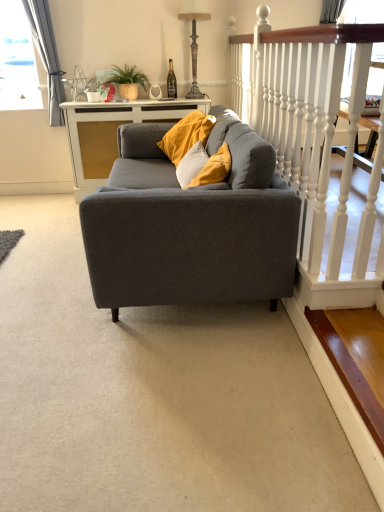
Question: Does wooden stair at lower right have a lesser height compared to matte gray couch at center?

Choices:
 (A) no
 (B) yes

Answer: (B)

Question: Is wooden stair at lower right not close to matte gray couch at center?

Choices:
 (A) yes
 (B) no

Answer: (B)

Question: Is wooden stair at lower right further to the viewer compared to matte gray couch at center?

Choices:
 (A) no
 (B) yes

Answer: (A)

Question: Considering the relative sizes of wooden stair at lower right and matte gray couch at center in the image provided, is wooden stair at lower right wider than matte gray couch at center?

Choices:
 (A) yes
 (B) no

Answer: (B)

Question: Would you say matte gray couch at center is part of wooden stair at lower right's contents?

Choices:
 (A) no
 (B) yes

Answer: (A)

Question: From the image's perspective, relative to white glossy cabinet at center, is antique bronze lamp at upper center above or below?

Choices:
 (A) below
 (B) above

Answer: (B)

Question: Based on their positions, is antique bronze lamp at upper center located to the left or right of white glossy cabinet at center?

Choices:
 (A) right
 (B) left

Answer: (A)

Question: From their relative heights in the image, would you say antique bronze lamp at upper center is taller or shorter than white glossy cabinet at center?

Choices:
 (A) short
 (B) tall

Answer: (A)

Question: Does point (196, 50) appear closer or farther from the camera than point (135, 113)?

Choices:
 (A) closer
 (B) farther

Answer: (B)

Question: From the image's perspective, relative to matte gray couch at center, is white wooden railing at upper right above or below?

Choices:
 (A) above
 (B) below

Answer: (A)

Question: Considering their positions, is white wooden railing at upper right located in front of or behind matte gray couch at center?

Choices:
 (A) front
 (B) behind

Answer: (A)

Question: Considering the positions of white wooden railing at upper right and matte gray couch at center in the image, is white wooden railing at upper right taller or shorter than matte gray couch at center?

Choices:
 (A) tall
 (B) short

Answer: (A)

Question: Based on their positions, is white wooden railing at upper right located to the left or right of matte gray couch at center?

Choices:
 (A) left
 (B) right

Answer: (B)

Question: From the image's perspective, is wooden stair at lower right located above or below white glossy cabinet at center?

Choices:
 (A) below
 (B) above

Answer: (A)

Question: From a real-world perspective, is wooden stair at lower right above or below white glossy cabinet at center?

Choices:
 (A) below
 (B) above

Answer: (A)